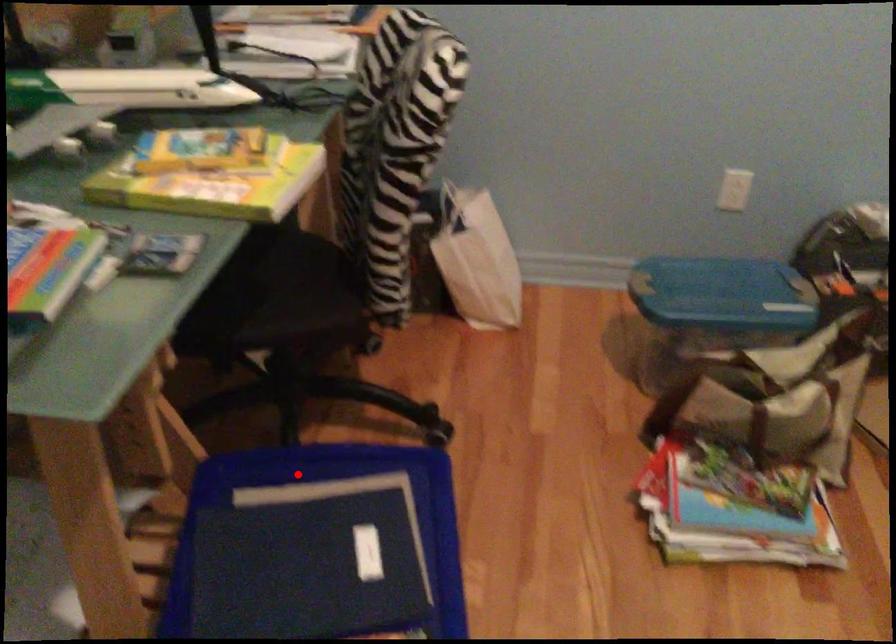
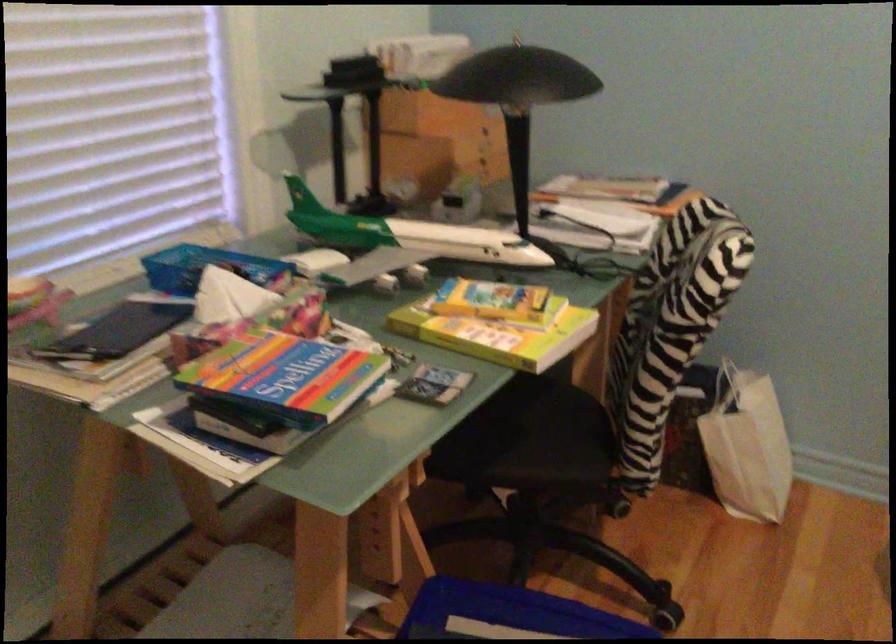
In the second image, find the point that corresponds to the highlighted location in the first image.

(507, 614)